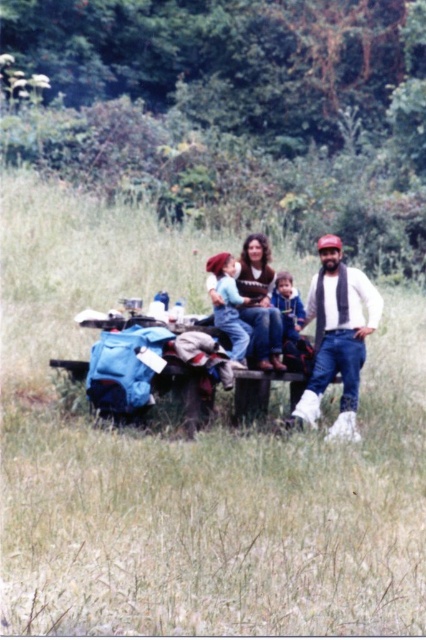
Question: Which object is positioned farthest from the knitted sweater at center?

Choices:
 (A) green grass at center
 (B) light blue denim jeans at center

Answer: (A)

Question: Estimate the real-world distances between objects in this image. Which object is farther from the white matte scarf at right?

Choices:
 (A) light blue denim jeans at center
 (B) knitted sweater at center
 (C) green grass at center
 (D) light blue denim overalls at center

Answer: (C)

Question: Which object is closer to the camera taking this photo?

Choices:
 (A) light blue denim overalls at center
 (B) green grass at center
 (C) white matte scarf at right

Answer: (B)

Question: Can you confirm if white matte scarf at right is smaller than light blue denim overalls at center?

Choices:
 (A) no
 (B) yes

Answer: (A)

Question: Is green grass at center below white matte scarf at right?

Choices:
 (A) yes
 (B) no

Answer: (A)

Question: Is the position of white matte scarf at right less distant than that of light blue denim jeans at center?

Choices:
 (A) yes
 (B) no

Answer: (A)